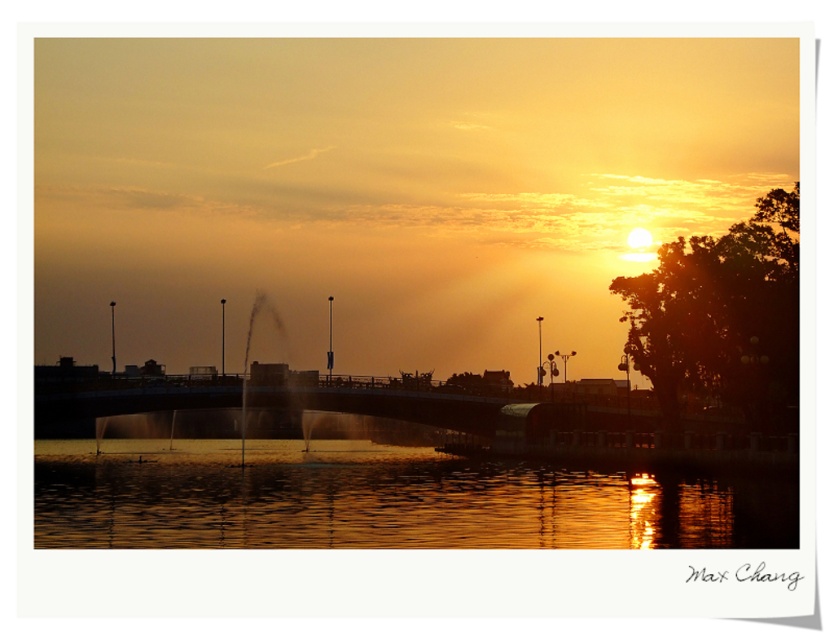
Question: Is shiny reflective water at center behind metallic bridge at center?

Choices:
 (A) yes
 (B) no

Answer: (B)

Question: Among these points, which one is farthest from the camera?

Choices:
 (A) (78, 422)
 (B) (46, 512)

Answer: (A)

Question: Does shiny reflective water at center have a larger size compared to metallic bridge at center?

Choices:
 (A) no
 (B) yes

Answer: (A)

Question: Among these objects, which one is nearest to the camera?

Choices:
 (A) shiny reflective water at center
 (B) metallic bridge at center

Answer: (A)

Question: Which of the following is the farthest from the observer?

Choices:
 (A) metallic bridge at center
 (B) shiny reflective water at center

Answer: (A)

Question: Can you confirm if shiny reflective water at center is thinner than metallic bridge at center?

Choices:
 (A) no
 (B) yes

Answer: (A)